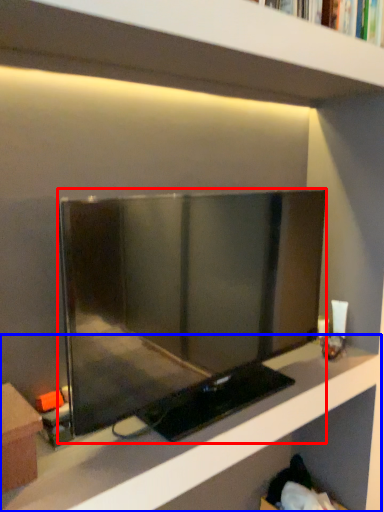
Question: Among these objects, which one is nearest to the camera, television (highlighted by a red box) or shelf (highlighted by a blue box)?

Choices:
 (A) television
 (B) shelf

Answer: (B)